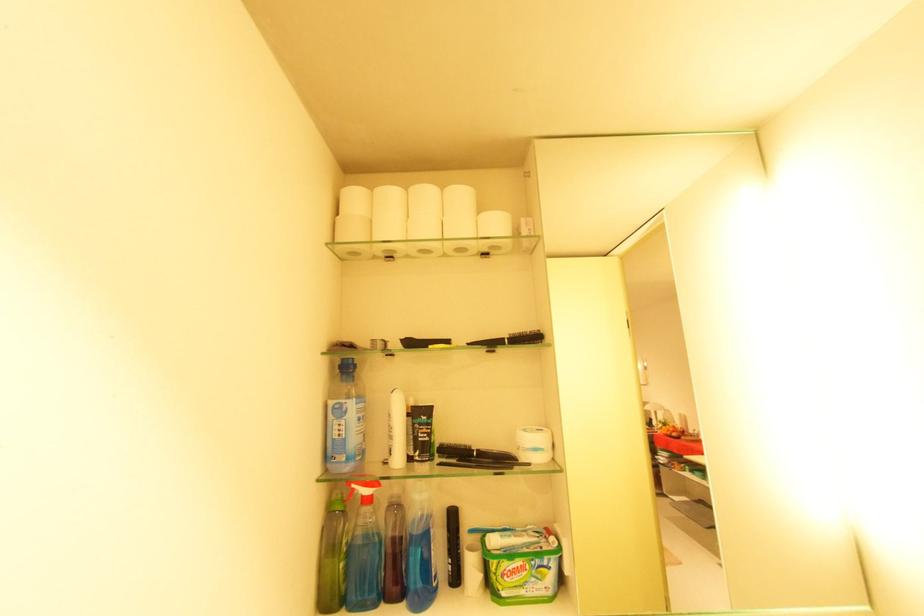
In order to click on blue toothbrush in this screenshot , I will do `click(420, 552)`.